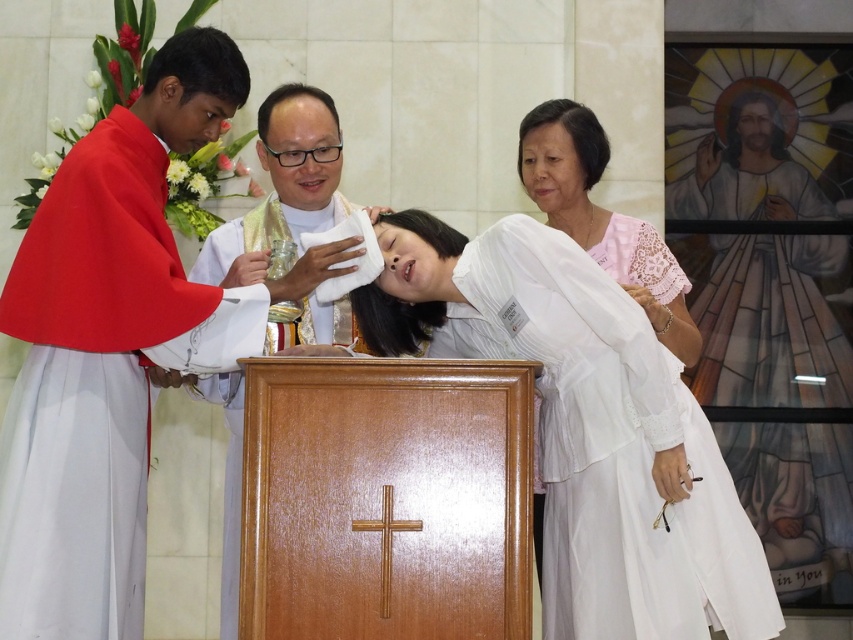
Who is higher up, white lace robe at center or white lace dress at right?

white lace dress at right is above.

Is white lace robe at center smaller than white lace dress at right?

Incorrect, white lace robe at center is not smaller in size than white lace dress at right.

Between point (564, 332) and point (693, 353), which one is positioned behind?

Positioned behind is point (693, 353).

The width and height of the screenshot is (853, 640). In order to click on white lace robe at center in this screenshot , I will do click(608, 448).

Is white lace robe at upper right below white silk cloth at center?

Actually, white lace robe at upper right is above white silk cloth at center.

Find the location of `white lace robe at upper right`. white lace robe at upper right is located at coordinates (770, 321).

Describe the element at coordinates (770, 321) in the screenshot. I see `white lace robe at upper right` at that location.

Where is `white lace robe at upper right`? This screenshot has width=853, height=640. white lace robe at upper right is located at coordinates (770, 321).

At what (x,y) coordinates should I click in order to perform the action: click on white lace robe at center. Please return your answer as a coordinate pair (x, y). The height and width of the screenshot is (640, 853). Looking at the image, I should click on (608, 448).

From the picture: Is white lace robe at center to the right of white lace robe at upper right from the viewer's perspective?

No, white lace robe at center is not to the right of white lace robe at upper right.

At what (x,y) coordinates should I click in order to perform the action: click on white lace robe at center. Please return your answer as a coordinate pair (x, y). Image resolution: width=853 pixels, height=640 pixels. Looking at the image, I should click on (608, 448).

I want to click on white lace robe at center, so click(x=608, y=448).